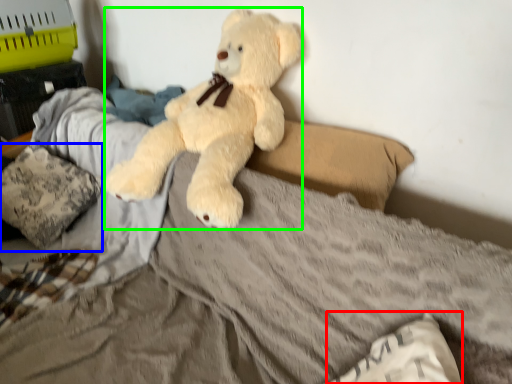
Question: Estimate the real-world distances between objects in this image. Which object is closer to pillow (highlighted by a red box), pillow (highlighted by a blue box) or teddy bear (highlighted by a green box)?

Choices:
 (A) pillow
 (B) teddy bear

Answer: (B)